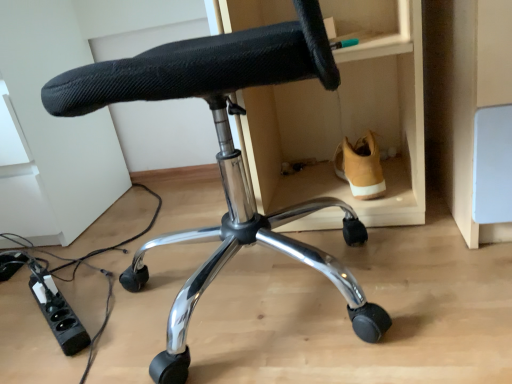
Identify the location of tan suede shoe at lower right. This screenshot has height=384, width=512. [x=360, y=167].

Does black mesh chair at center have a greater width compared to black plastic power strip at lower left?

Yes, black mesh chair at center is wider than black plastic power strip at lower left.

Can you confirm if black mesh chair at center is positioned to the left of black plastic power strip at lower left?

No.

This screenshot has width=512, height=384. Find the location of `plug that is under the black mesh chair at center (from a real-world perspective)`. plug that is under the black mesh chair at center (from a real-world perspective) is located at coordinates (58, 314).

Is there a large distance between tan suede shoe at lower right and black plastic power strip at lower left?

They are positioned close to each other.

From a real-world perspective, who is located higher, tan suede shoe at lower right or black plastic power strip at lower left?

In real-world perspective, tan suede shoe at lower right is above.

Where is `plug that appears on the left of tan suede shoe at lower right`? The image size is (512, 384). plug that appears on the left of tan suede shoe at lower right is located at coordinates (58, 314).

Would you say tan suede shoe at lower right is outside black plastic power strip at lower left?

tan suede shoe at lower right is positioned outside black plastic power strip at lower left.

Considering the points (178, 325) and (359, 172), which point is in front, point (178, 325) or point (359, 172)?

The point (178, 325) is closer to the camera.

From their relative heights in the image, would you say black mesh chair at center is taller or shorter than tan suede shoe at lower right?

Considering their sizes, black mesh chair at center has more height than tan suede shoe at lower right.

From the image's perspective, does black mesh chair at center appear lower than tan suede shoe at lower right?

Correct, black mesh chair at center appears lower than tan suede shoe at lower right in the image.

Which object is closer to the camera taking this photo, black mesh chair at center or tan suede shoe at lower right?

black mesh chair at center is closer to the camera.

In the scene shown: Are black plastic power strip at lower left and tan suede shoe at lower right far apart?

No.

Is black plastic power strip at lower left spatially inside tan suede shoe at lower right, or outside of it?

black plastic power strip at lower left lies outside tan suede shoe at lower right.

Which of these two, black plastic power strip at lower left or tan suede shoe at lower right, is bigger?

tan suede shoe at lower right.

Is black plastic power strip at lower left facing away from tan suede shoe at lower right?

No, black plastic power strip at lower left is not facing away from tan suede shoe at lower right.

Considering the sizes of tan suede shoe at lower right and black mesh chair at center in the image, is tan suede shoe at lower right taller or shorter than black mesh chair at center?

tan suede shoe at lower right is shorter than black mesh chair at center.

Looking at the image, does tan suede shoe at lower right seem bigger or smaller compared to black mesh chair at center?

Considering their sizes, tan suede shoe at lower right takes up less space than black mesh chair at center.

From a real-world perspective, does tan suede shoe at lower right stand above black mesh chair at center?

No, from a real-world perspective, tan suede shoe at lower right is not above black mesh chair at center.

Could you tell me if tan suede shoe at lower right is turned towards black mesh chair at center?

No.

Which object is closer to the camera taking this photo, black plastic power strip at lower left or black mesh chair at center?

black mesh chair at center is more forward.

Are black plastic power strip at lower left and black mesh chair at center beside each other?

No, black plastic power strip at lower left is not next to black mesh chair at center.

Could you tell me if black plastic power strip at lower left is facing black mesh chair at center?

Yes, black plastic power strip at lower left is turned towards black mesh chair at center.

Can you confirm if black plastic power strip at lower left is thinner than black mesh chair at center?

Yes, black plastic power strip at lower left is thinner than black mesh chair at center.

You are a GUI agent. You are given a task and a screenshot of the screen. Output one action in this format:
    pyautogui.click(x=<x>, y=<y>)
    Task: Click on the chair in front of the black plastic power strip at lower left
    The width and height of the screenshot is (512, 384).
    Given the screenshot: What is the action you would take?
    pyautogui.click(x=224, y=155)

Image resolution: width=512 pixels, height=384 pixels. What are the coordinates of `footwear that is behind the black plastic power strip at lower left` in the screenshot? It's located at (360, 167).

Based on their spatial positions, is tan suede shoe at lower right or black mesh chair at center closer to black plastic power strip at lower left?

black mesh chair at center is positioned closer to the anchor black plastic power strip at lower left.

In the scene shown: Which object lies further to the anchor point black mesh chair at center, tan suede shoe at lower right or black plastic power strip at lower left?

black plastic power strip at lower left lies further to black mesh chair at center than the other object.

Based on their spatial positions, is black plastic power strip at lower left or black mesh chair at center further from tan suede shoe at lower right?

black plastic power strip at lower left is further to tan suede shoe at lower right.

When comparing their distances from black mesh chair at center, does black plastic power strip at lower left or tan suede shoe at lower right seem closer?

tan suede shoe at lower right is positioned closer to the anchor black mesh chair at center.

Considering their positions, is black mesh chair at center positioned closer to black plastic power strip at lower left than tan suede shoe at lower right?

black mesh chair at center.

Looking at the image, which one is located further to tan suede shoe at lower right, black mesh chair at center or black plastic power strip at lower left?

black plastic power strip at lower left.

Where is `chair between black plastic power strip at lower left and tan suede shoe at lower right in the horizontal direction`? This screenshot has height=384, width=512. chair between black plastic power strip at lower left and tan suede shoe at lower right in the horizontal direction is located at coordinates (224, 155).